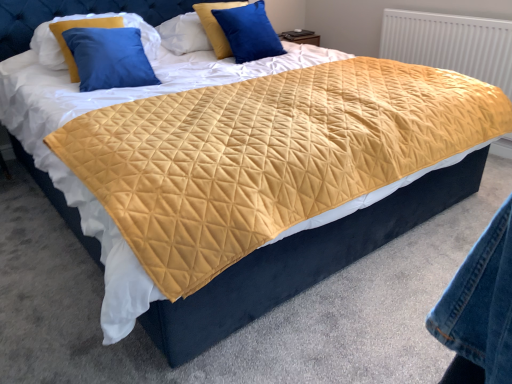
Question: Is blue velvet pillow at upper center, the 1th pillow positioned from the right, spatially inside quilted yellow fabric at center, or outside of it?

Choices:
 (A) inside
 (B) outside

Answer: (B)

Question: From their relative heights in the image, would you say blue velvet pillow at upper center, arranged as the 3th pillow when viewed from the left, is taller or shorter than quilted yellow fabric at center?

Choices:
 (A) tall
 (B) short

Answer: (A)

Question: Estimate the real-world distances between objects in this image. Which object is closer to the blue velvet pillow at upper center, positioned as the second pillow in left-to-right order?

Choices:
 (A) white textured radiator at upper right
 (B) blue velvet pillow at upper center, arranged as the 3th pillow when viewed from the left
 (C) velvet blue pillow at upper left, which ranks as the third pillow in right-to-left order
 (D) quilted yellow fabric at center

Answer: (B)

Question: Estimate the real-world distances between objects in this image. Which object is closer to the quilted yellow fabric at center?

Choices:
 (A) blue velvet pillow at upper center, the second pillow from the right
 (B) blue velvet pillow at upper center, arranged as the 3th pillow when viewed from the left
 (C) velvet blue pillow at upper left, placed as the first pillow when sorted from left to right
 (D) white textured radiator at upper right

Answer: (D)